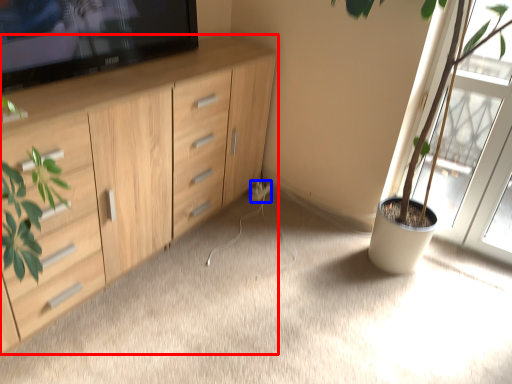
Question: Among these objects, which one is nearest to the camera, cabinetry (highlighted by a red box) or electric outlet (highlighted by a blue box)?

Choices:
 (A) cabinetry
 (B) electric outlet

Answer: (A)